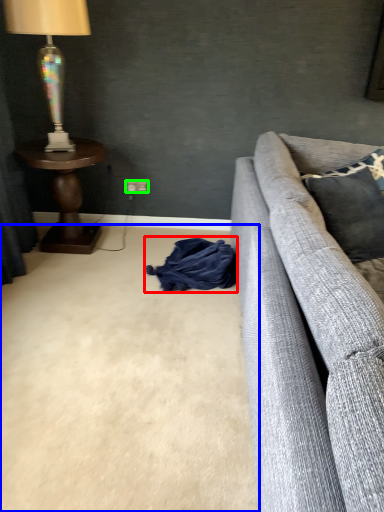
Question: Estimate the real-world distances between objects in this image. Which object is farther from material (highlighted by a red box), plain (highlighted by a blue box) or power outlet (highlighted by a green box)?

Choices:
 (A) plain
 (B) power outlet

Answer: (B)